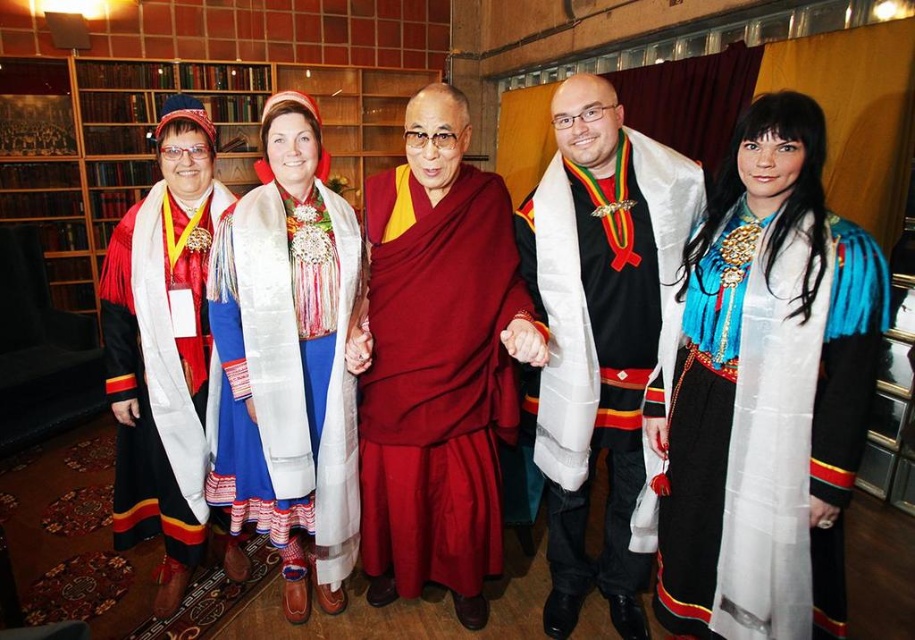
You are a photographer at this event and need to arrange the blue silk dress at center and the black velvet robe at center so that both are fully visible in the photo. Which one should be placed closer to the camera to ensure both are visible without cropping?

The blue silk dress at center is smaller than the black velvet robe at center, so placing the smaller blue silk dress at center closer to the camera will ensure both are fully visible without cropping.

You are attending a cultural ceremony and need to approach the two central figures wearing the maroon silk robe at center and the black velvet robe at center. Which one should you approach first based on their positions?

You should approach the maroon silk robe at center first because it is closer to you than the black velvet robe at center.